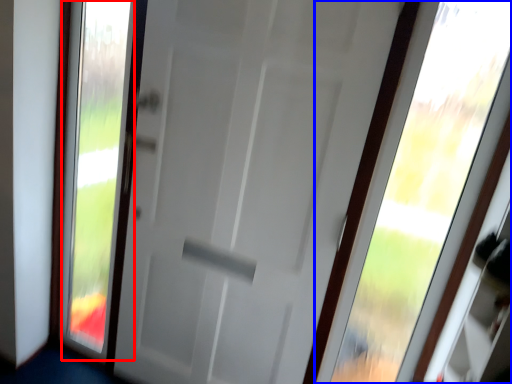
Question: Which object is closer to the camera taking this photo, glass window (highlighted by a red box) or window (highlighted by a blue box)?

Choices:
 (A) glass window
 (B) window

Answer: (B)